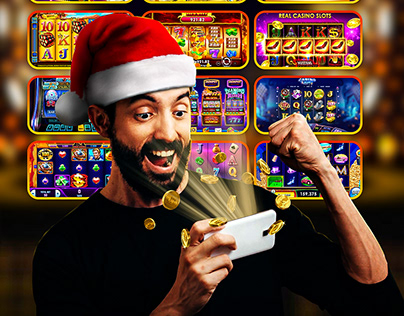
Identify the location of phone. (255, 228).